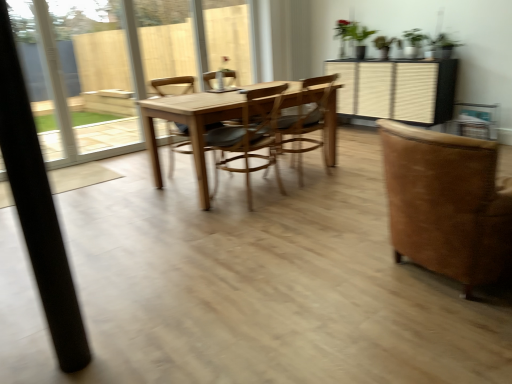
Where is `vacant space behind black matte pole at left`? This screenshot has height=384, width=512. vacant space behind black matte pole at left is located at coordinates (104, 325).